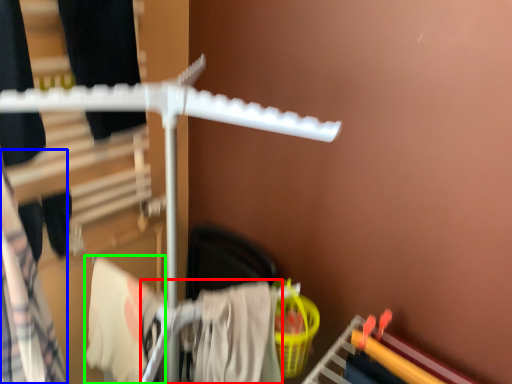
Question: Which object is the closest to the clothing (highlighted by a red box)? Choose among these: clothing (highlighted by a blue box) or clothing (highlighted by a green box).

Choices:
 (A) clothing
 (B) clothing

Answer: (B)